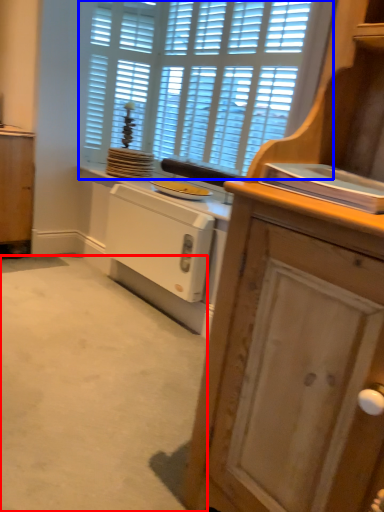
Question: Which of the following is the closest to the observer, plain (highlighted by a red box) or window (highlighted by a blue box)?

Choices:
 (A) plain
 (B) window

Answer: (A)